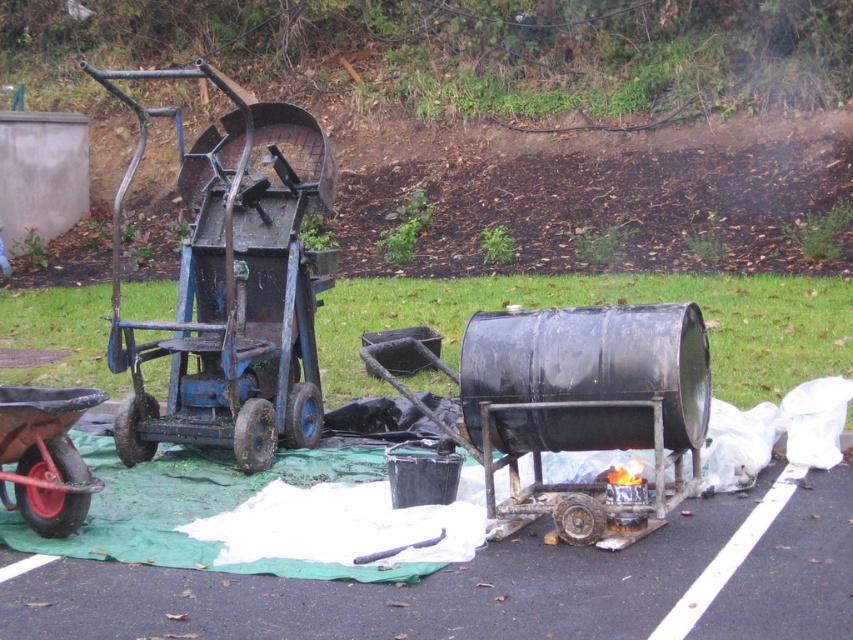
Is point (202, 362) positioned after point (10, 444)?

Yes, it is behind point (10, 444).

This screenshot has width=853, height=640. I want to click on rusty metal cart at center, so click(231, 285).